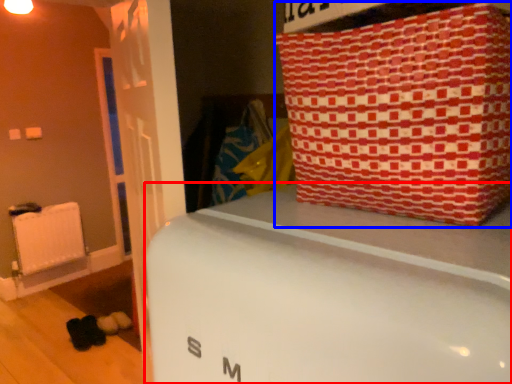
Question: Among these objects, which one is farthest to the camera, furniture (highlighted by a red box) or package (highlighted by a blue box)?

Choices:
 (A) furniture
 (B) package

Answer: (B)